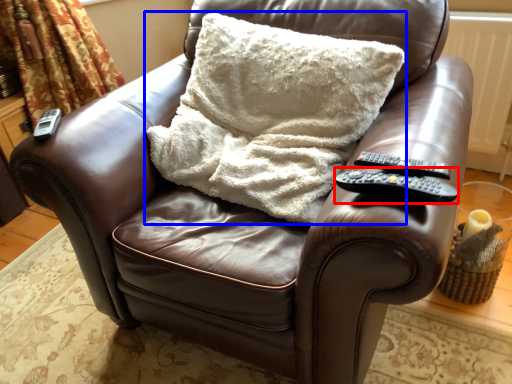
Question: Which object appears closest to the camera in this image, remote (highlighted by a red box) or pillow (highlighted by a blue box)?

Choices:
 (A) remote
 (B) pillow

Answer: (A)